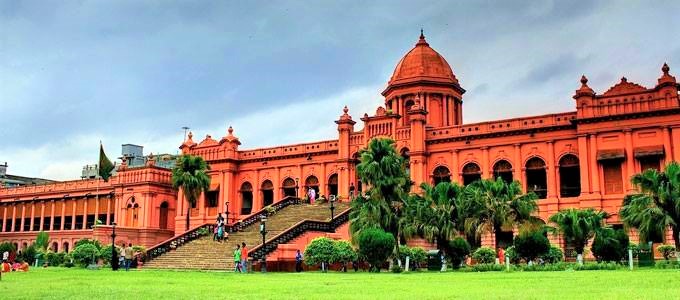
Locate an element on the screen. The image size is (680, 300). stairs is located at coordinates (217, 260).